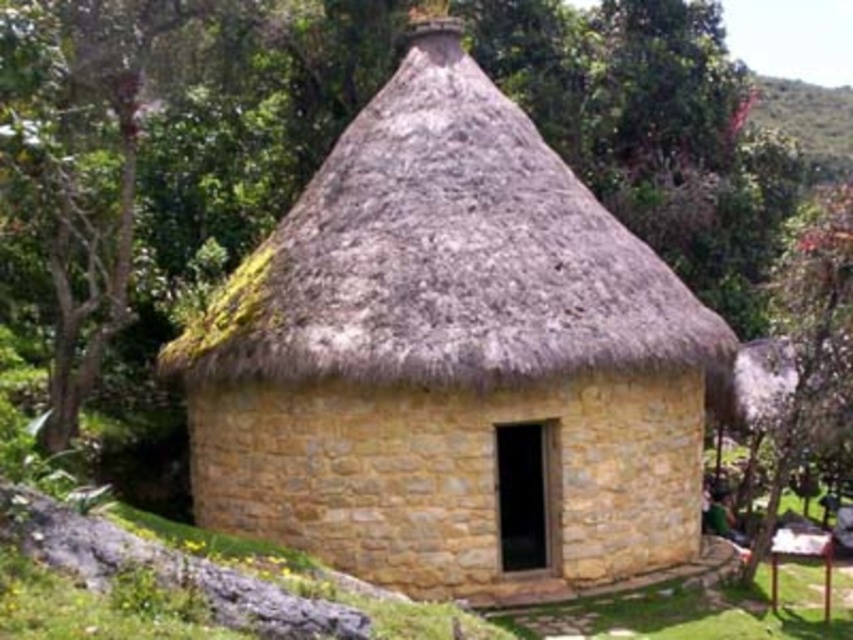
You are standing in front of the traditional round hut and want to determine the relative positions of two points marked on the image. Which point is closer to you, point 1 at coordinates point (653,310) or point 2 at coordinates point (845,292)?

Point 2 at coordinates point (845,292) is closer to you because it is further away from the camera than point 1. Since you are standing in front of the hut, the point further from the camera would appear closer to your position.